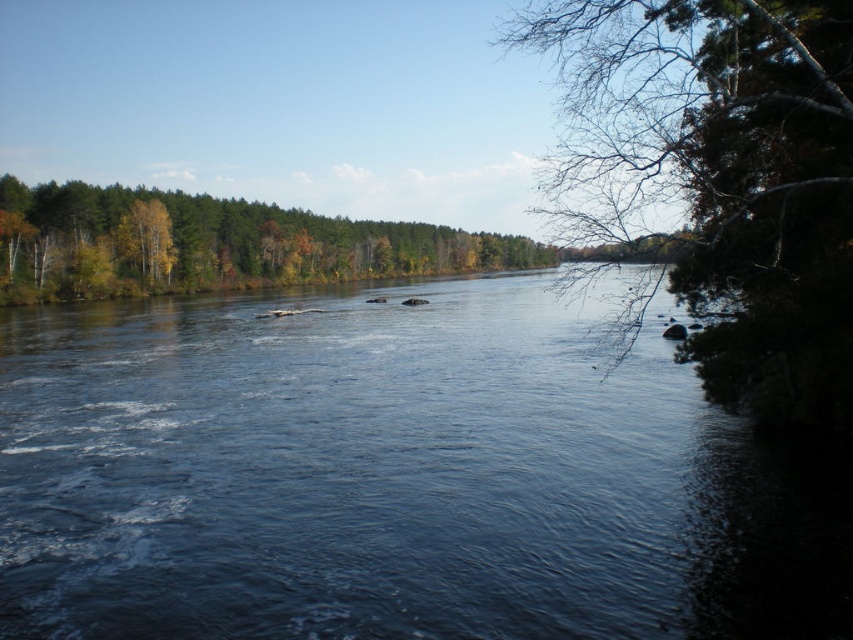
Question: Can you confirm if dark blue water at center is bigger than green matte tree at upper left?

Choices:
 (A) no
 (B) yes

Answer: (A)

Question: Which of the following is the closest to the observer?

Choices:
 (A) (146, 280)
 (B) (772, 316)
 (C) (161, 550)

Answer: (C)

Question: Among these objects, which one is nearest to the camera?

Choices:
 (A) dark blue water at center
 (B) yellow-green leaves at left
 (C) green leafy tree at right

Answer: (A)

Question: Can you confirm if dark blue water at center is positioned above green matte tree at upper left?

Choices:
 (A) no
 (B) yes

Answer: (A)

Question: Among these points, which one is farthest from the camera?

Choices:
 (A) (109, 422)
 (B) (364, 237)
 (C) (167, 269)

Answer: (B)

Question: Is green leafy tree at right wider than yellow-green leaves at left?

Choices:
 (A) no
 (B) yes

Answer: (B)